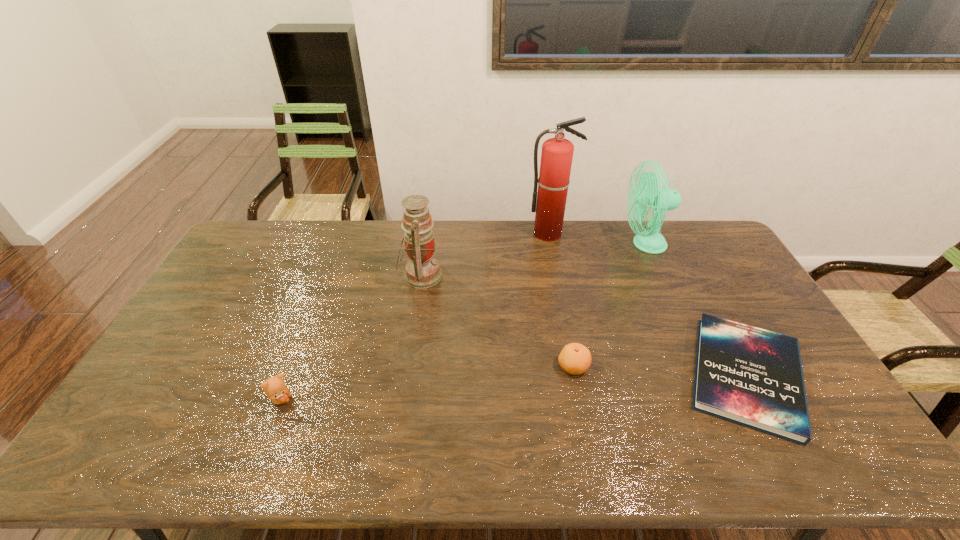
Locate an element on the screen. The width and height of the screenshot is (960, 540). unoccupied position between the fire extinguisher and the second object from left to right is located at coordinates coord(485,254).

Identify the location of vacant area that lies between the fifth tallest object and the fourth tallest object. This screenshot has width=960, height=540. (427, 383).

At what (x,y) coordinates should I click in order to perform the action: click on free area in between the oil lamp and the fan. Please return your answer as a coordinate pair (x, y). Looking at the image, I should click on (533, 260).

Find the location of `vacant area between the tallest object and the fifth object from right to left`. vacant area between the tallest object and the fifth object from right to left is located at coordinates (485, 254).

I want to click on free point between the shortest object and the fan, so click(695, 310).

You are a GUI agent. You are given a task and a screenshot of the screen. Output one action in this format:
    pyautogui.click(x=<x>, y=<y>)
    Task: Click on the vacant region between the hardback book and the second shortest object
    Image resolution: width=960 pixels, height=540 pixels.
    Given the screenshot: What is the action you would take?
    pyautogui.click(x=660, y=371)

Identify which object is the fifth nearest to the clementine. Please provide its 2D coordinates. Your answer should be formatted as a tuple, i.e. [(x, y)], where the tuple contains the x and y coordinates of a point satisfying the conditions above.

[(275, 388)]

This screenshot has height=540, width=960. I want to click on object that is the closest to the hardback book, so pyautogui.click(x=574, y=358).

You are a GUI agent. You are given a task and a screenshot of the screen. Output one action in this format:
    pyautogui.click(x=<x>, y=<y>)
    Task: Click on the free spot that satisfies the following two spatial constraints: 1. with the nozzle and gauge on the tallest object; 2. on the face of the third shortest object
    The width and height of the screenshot is (960, 540).
    Given the screenshot: What is the action you would take?
    pyautogui.click(x=582, y=400)

Locate an element on the screen. free spot that satisfies the following two spatial constraints: 1. in front of the hardback book to blow air; 2. on the left side of the fan is located at coordinates (704, 375).